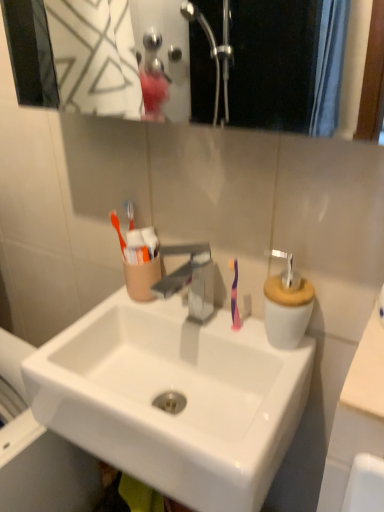
Question: Can you confirm if white glossy sink at center is shorter than beige matte counter top at right, arranged as the 1th counter top when viewed from the right?

Choices:
 (A) yes
 (B) no

Answer: (B)

Question: Does white glossy sink at center appear on the left side of beige matte counter top at right, arranged as the second counter top when viewed from the left?

Choices:
 (A) no
 (B) yes

Answer: (B)

Question: Is white glossy sink at center positioned with its back to beige matte counter top at right, arranged as the 1th counter top when viewed from the right?

Choices:
 (A) yes
 (B) no

Answer: (B)

Question: From a real-world perspective, is white glossy sink at center on beige matte counter top at right, arranged as the second counter top when viewed from the left?

Choices:
 (A) no
 (B) yes

Answer: (A)

Question: From the image's perspective, is white glossy sink at center under beige matte counter top at right, arranged as the second counter top when viewed from the left?

Choices:
 (A) yes
 (B) no

Answer: (A)

Question: Based on their sizes in the image, would you say beige matte counter top at right, arranged as the second counter top when viewed from the left, is bigger or smaller than purple glossy toothbrush at center?

Choices:
 (A) big
 (B) small

Answer: (A)

Question: From a real-world perspective, is beige matte counter top at right, arranged as the 1th counter top when viewed from the right, positioned above or below purple glossy toothbrush at center?

Choices:
 (A) below
 (B) above

Answer: (B)

Question: Visually, is beige matte counter top at right, arranged as the second counter top when viewed from the left, positioned to the left or to the right of purple glossy toothbrush at center?

Choices:
 (A) left
 (B) right

Answer: (B)

Question: Is beige matte counter top at right, arranged as the 1th counter top when viewed from the right, wider or thinner than purple glossy toothbrush at center?

Choices:
 (A) thin
 (B) wide

Answer: (B)

Question: Is white ceramic soap dispenser at right wider or thinner than white glossy sink at center?

Choices:
 (A) thin
 (B) wide

Answer: (A)

Question: From a real-world perspective, is white ceramic soap dispenser at right above or below white glossy sink at center?

Choices:
 (A) below
 (B) above

Answer: (B)

Question: From the image's perspective, relative to white glossy sink at center, is white ceramic soap dispenser at right above or below?

Choices:
 (A) below
 (B) above

Answer: (B)

Question: Is white ceramic soap dispenser at right taller or shorter than white glossy sink at center?

Choices:
 (A) short
 (B) tall

Answer: (A)

Question: Is point (347, 374) positioned closer to the camera than point (188, 414)?

Choices:
 (A) closer
 (B) farther

Answer: (B)

Question: Based on their sizes in the image, would you say beige matte counter top at right, arranged as the second counter top when viewed from the left, is bigger or smaller than white glossy sink at center?

Choices:
 (A) big
 (B) small

Answer: (B)